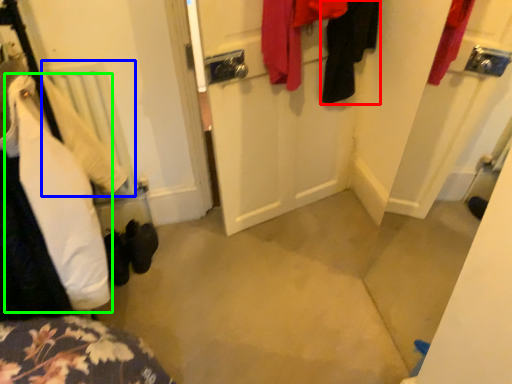
Question: Considering the real-world distances, which object is closest to clothing (highlighted by a red box)? radiator (highlighted by a blue box) or clothing (highlighted by a green box).

Choices:
 (A) radiator
 (B) clothing

Answer: (A)